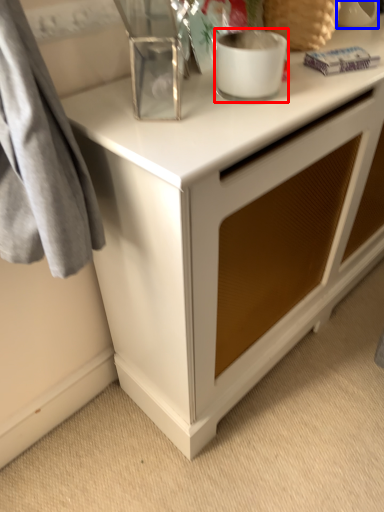
Question: Which object appears farthest to the camera in this image, appliance (highlighted by a red box) or appliance (highlighted by a blue box)?

Choices:
 (A) appliance
 (B) appliance

Answer: (B)